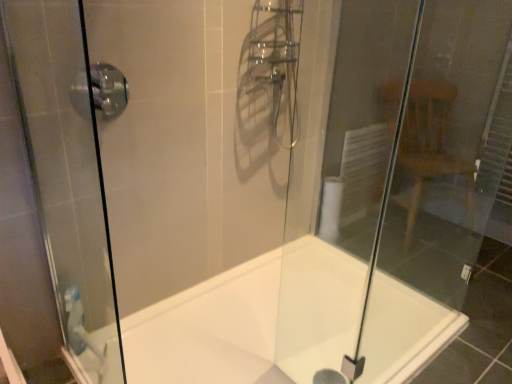
Question: Can you confirm if transparent glass shower door at left is smaller than white glossy bathtub at center?

Choices:
 (A) yes
 (B) no

Answer: (A)

Question: Can you confirm if transparent glass shower door at left is bigger than white glossy bathtub at center?

Choices:
 (A) no
 (B) yes

Answer: (A)

Question: Is transparent glass shower door at left next to white glossy bathtub at center?

Choices:
 (A) yes
 (B) no

Answer: (B)

Question: Can you confirm if transparent glass shower door at left is positioned to the right of white glossy bathtub at center?

Choices:
 (A) no
 (B) yes

Answer: (A)

Question: Can you confirm if transparent glass shower door at left is positioned to the left of white glossy bathtub at center?

Choices:
 (A) no
 (B) yes

Answer: (B)

Question: Considering the positions of satin chrome shower handle at upper left and white glossy bathtub at center in the image, is satin chrome shower handle at upper left wider or thinner than white glossy bathtub at center?

Choices:
 (A) thin
 (B) wide

Answer: (A)

Question: Relative to white glossy bathtub at center, is satin chrome shower handle at upper left in front or behind?

Choices:
 (A) behind
 (B) front

Answer: (A)

Question: Which is correct: satin chrome shower handle at upper left is inside white glossy bathtub at center, or outside of it?

Choices:
 (A) outside
 (B) inside

Answer: (A)

Question: From the image's perspective, is satin chrome shower handle at upper left located above or below white glossy bathtub at center?

Choices:
 (A) below
 (B) above

Answer: (B)

Question: From a real-world perspective, is white glossy bathtub at center physically located above or below transparent glass shower door at left?

Choices:
 (A) above
 (B) below

Answer: (B)

Question: Is white glossy bathtub at center taller or shorter than transparent glass shower door at left?

Choices:
 (A) short
 (B) tall

Answer: (A)

Question: In the image, is white glossy bathtub at center on the left side or the right side of transparent glass shower door at left?

Choices:
 (A) right
 (B) left

Answer: (A)

Question: Considering the positions of white glossy bathtub at center and transparent glass shower door at left in the image, is white glossy bathtub at center bigger or smaller than transparent glass shower door at left?

Choices:
 (A) small
 (B) big

Answer: (B)

Question: Considering the positions of transparent glass shower door at left and transparent glass door at right in the image, is transparent glass shower door at left taller or shorter than transparent glass door at right?

Choices:
 (A) short
 (B) tall

Answer: (A)

Question: Does point (115, 329) appear closer or farther from the camera than point (494, 122)?

Choices:
 (A) farther
 (B) closer

Answer: (B)